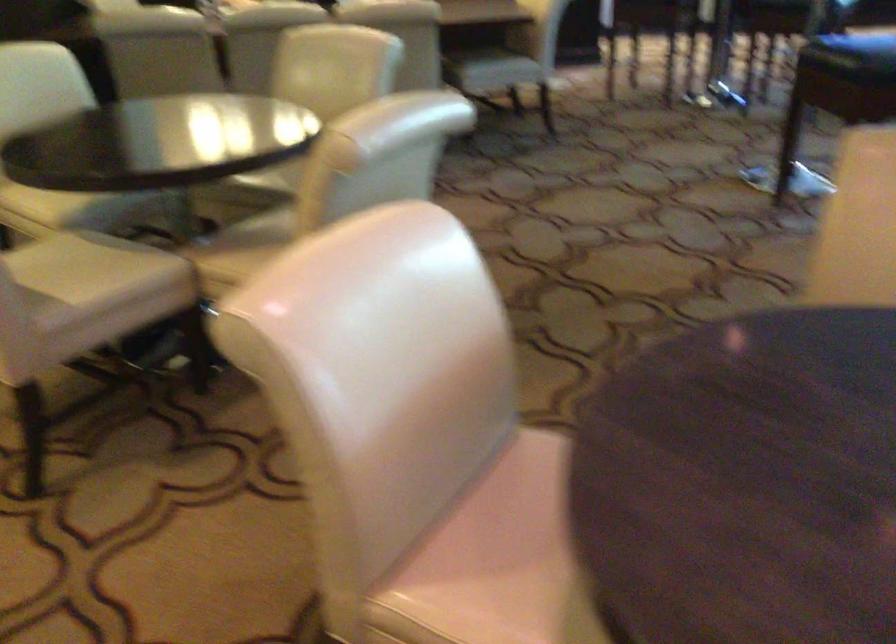
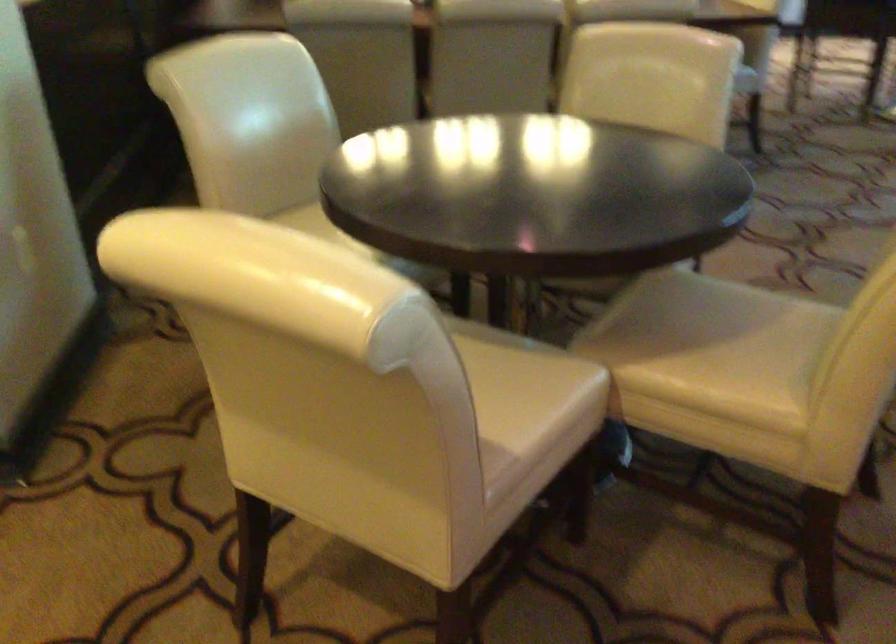
The point at (x=125, y=263) is marked in the first image. Where is the corresponding point in the second image?

(530, 377)